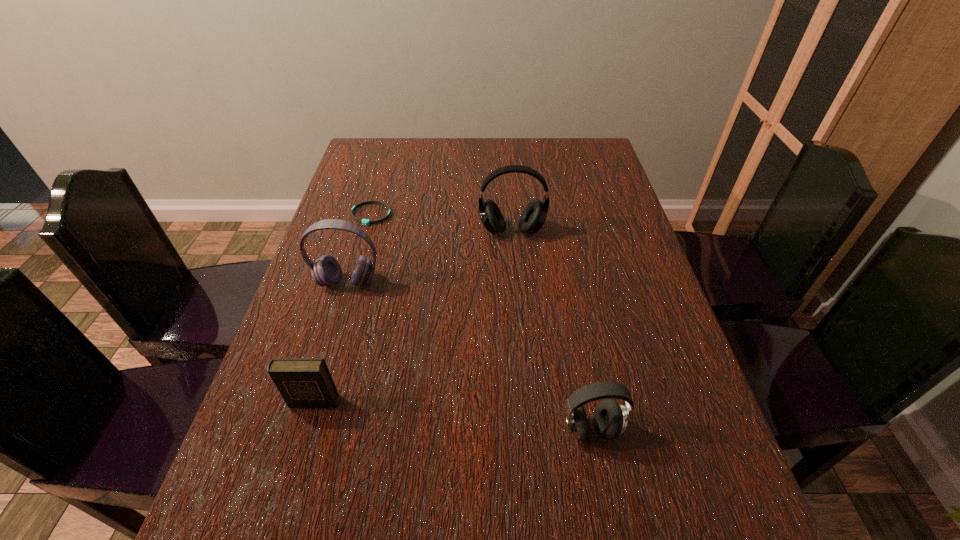
At what (x,y) coordinates should I click in order to perform the action: click on the farthest headset. Please return your answer as a coordinate pair (x, y). The image size is (960, 540). Looking at the image, I should click on (533, 217).

Find the location of a particular element. the leftmost headset is located at coordinates (326, 271).

Find the location of a particular element. the second nearest headset is located at coordinates (326, 271).

Locate an element on the screen. The width and height of the screenshot is (960, 540). the nearest headset is located at coordinates (610, 418).

You are a GUI agent. You are given a task and a screenshot of the screen. Output one action in this format:
    pyautogui.click(x=<x>, y=<y>)
    Task: Click on the shortest headset
    
    Given the screenshot: What is the action you would take?
    pyautogui.click(x=610, y=418)

This screenshot has width=960, height=540. I want to click on the second nearest object, so click(x=302, y=382).

This screenshot has height=540, width=960. I want to click on the shortest object, so click(x=367, y=222).

Where is `vacant space located 0.350m on the ear cups of the farthest headset`? vacant space located 0.350m on the ear cups of the farthest headset is located at coordinates tap(521, 350).

This screenshot has width=960, height=540. What are the coordinates of `free space located on the headband and ear cups of the second farthest headset` in the screenshot? It's located at (303, 433).

Locate an element on the screen. The height and width of the screenshot is (540, 960). free space located on the ear cups of the nearest object is located at coordinates (603, 491).